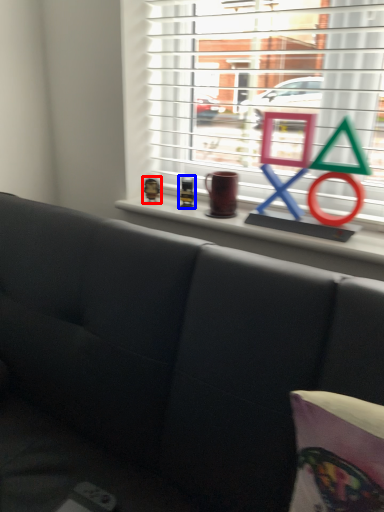
Question: Which object is closer to the camera taking this photo, toy (highlighted by a red box) or toy (highlighted by a blue box)?

Choices:
 (A) toy
 (B) toy

Answer: (B)